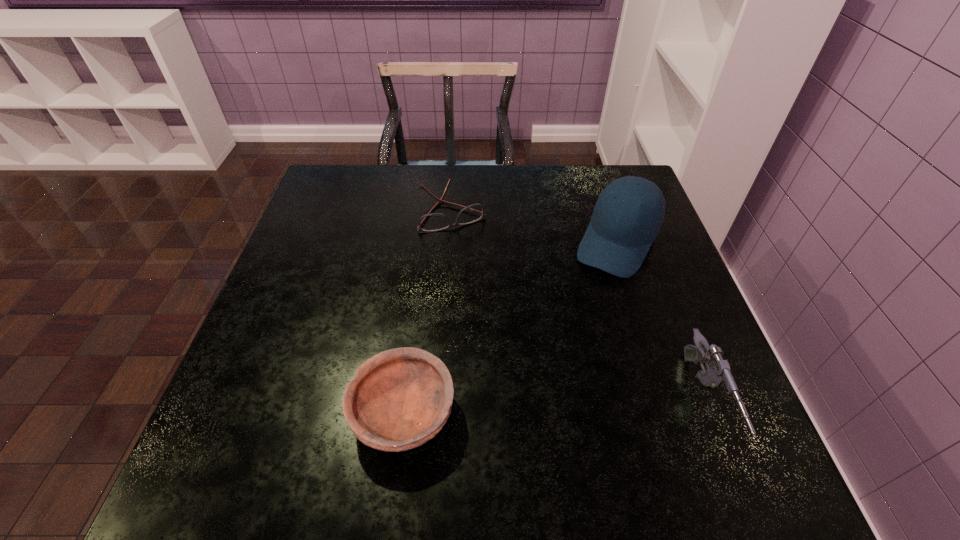
This screenshot has width=960, height=540. I want to click on free space on the desktop that is between the second shortest object and the third shortest object and is positioned on the front-facing side of the tallest object, so click(523, 408).

Identify the location of free spot on the desktop that is between the bowl and the second tallest object and is positioned on the front-facing side of the shortest object. (549, 408).